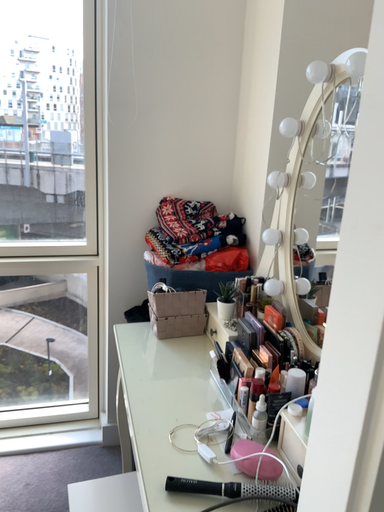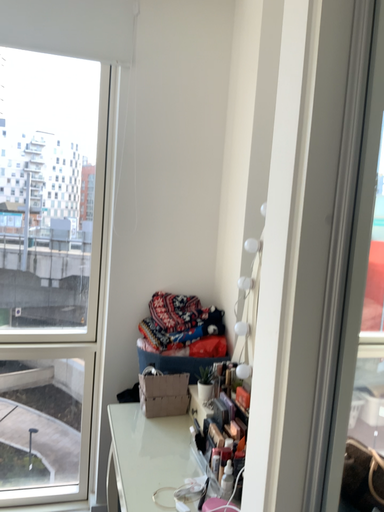
Question: How did the camera likely rotate when shooting the video?

Choices:
 (A) rotated upward
 (B) rotated downward

Answer: (A)